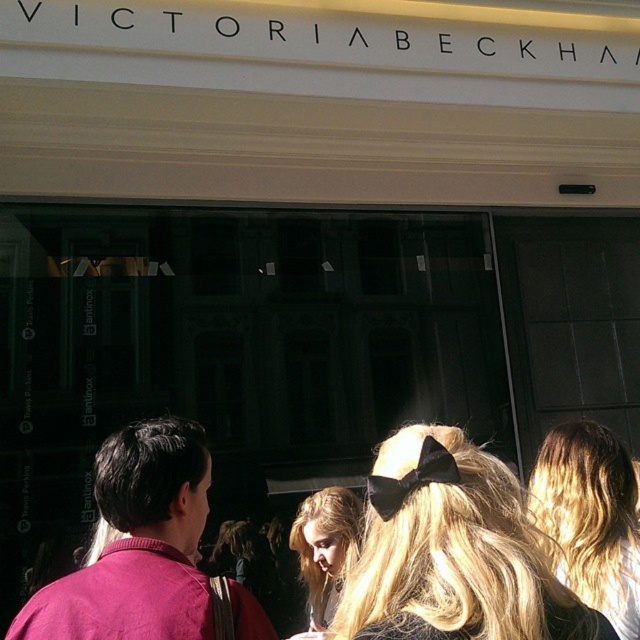
Is matte pink shirt at center taller than black velvet bow at upper center?

Yes.

Does matte pink shirt at center have a larger size compared to black velvet bow at upper center?

Yes.

Identify the location of matte pink shirt at center. Image resolution: width=640 pixels, height=640 pixels. (138, 545).